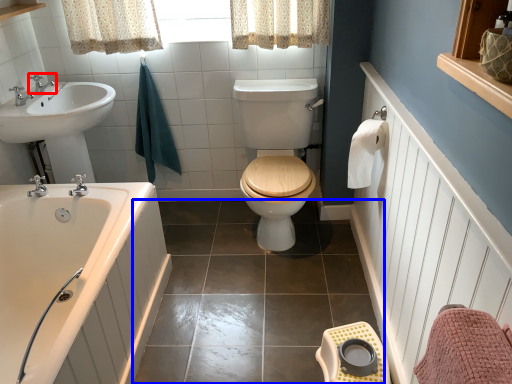
Question: Which of the following is the closest to the observer, tap (highlighted by a red box) or tile (highlighted by a blue box)?

Choices:
 (A) tap
 (B) tile

Answer: (B)